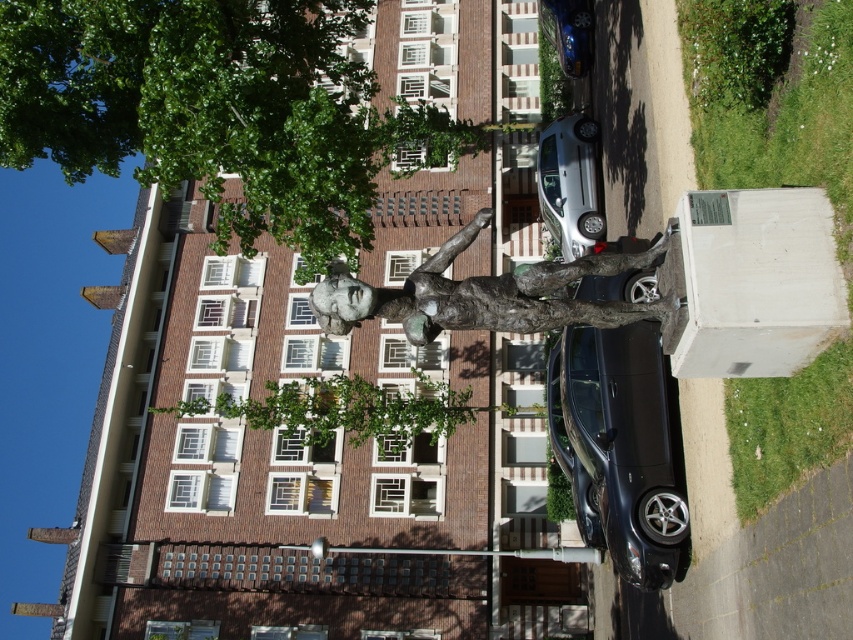
Can you confirm if shiny black sedan at center is shorter than silver metallic car at center?

Incorrect, shiny black sedan at center's height does not fall short of silver metallic car at center's.

The image size is (853, 640). What do you see at coordinates (618, 448) in the screenshot? I see `shiny black sedan at center` at bounding box center [618, 448].

Which is in front, point (653, 358) or point (578, 152)?

Point (653, 358) is in front.

Image resolution: width=853 pixels, height=640 pixels. Find the location of `shiny black sedan at center`. shiny black sedan at center is located at coordinates (618, 448).

Who is taller, green leafy tree at upper left or silver metallic car at center?

green leafy tree at upper left is taller.

Does point (263, 193) come behind point (569, 188)?

No, it is not.

You are a GUI agent. You are given a task and a screenshot of the screen. Output one action in this format:
    pyautogui.click(x=<x>, y=<y>)
    Task: Click on the green leafy tree at upper left
    This screenshot has height=640, width=853.
    Given the screenshot: What is the action you would take?
    pyautogui.click(x=218, y=109)

Is green leafy tree at upper left wider than green leafy tree at center?

No, green leafy tree at upper left is not wider than green leafy tree at center.

Does green leafy tree at upper left appear on the left side of green leafy tree at center?

Yes, green leafy tree at upper left is to the left of green leafy tree at center.

Is point (230, 218) farther from viewer compared to point (407, 410)?

That is False.

Identify the location of green leafy tree at upper left. (218, 109).